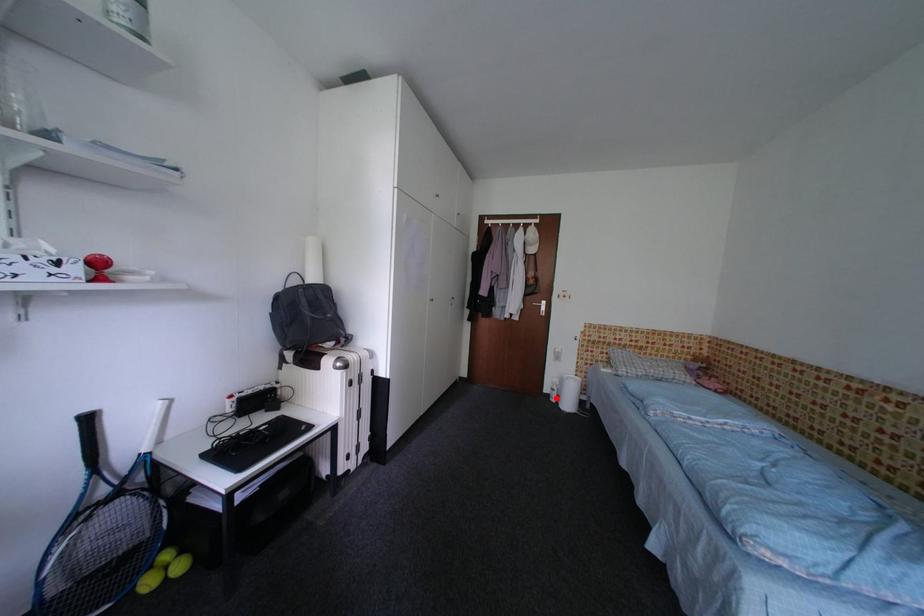
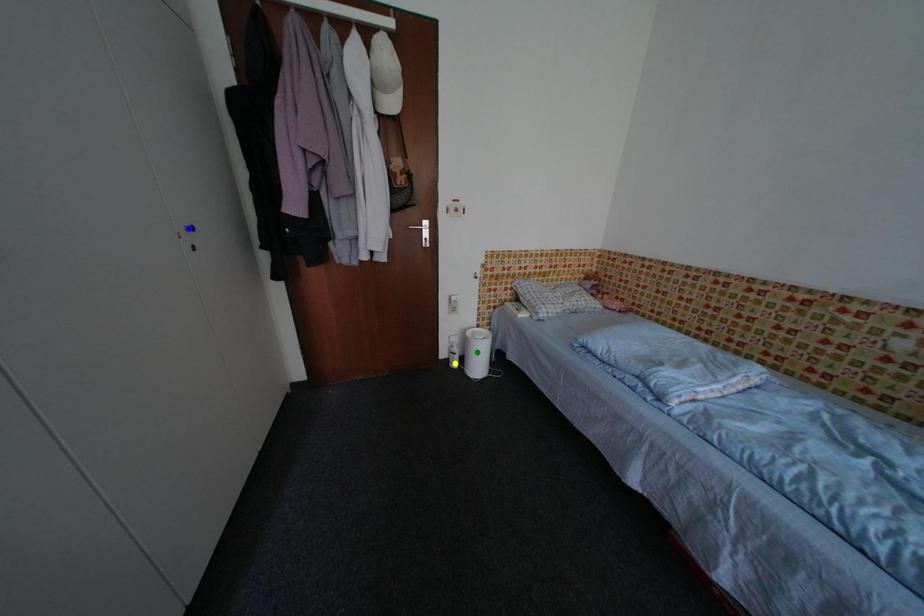
Question: I am providing you with two images of the same scene from different viewpoints. A red point is marked on the first image. You are given multiple points on the second image. In image 2, which mark is for the same physical point as the one in image 1?

Choices:
 (A) green point
 (B) blue point
 (C) yellow point

Answer: (C)